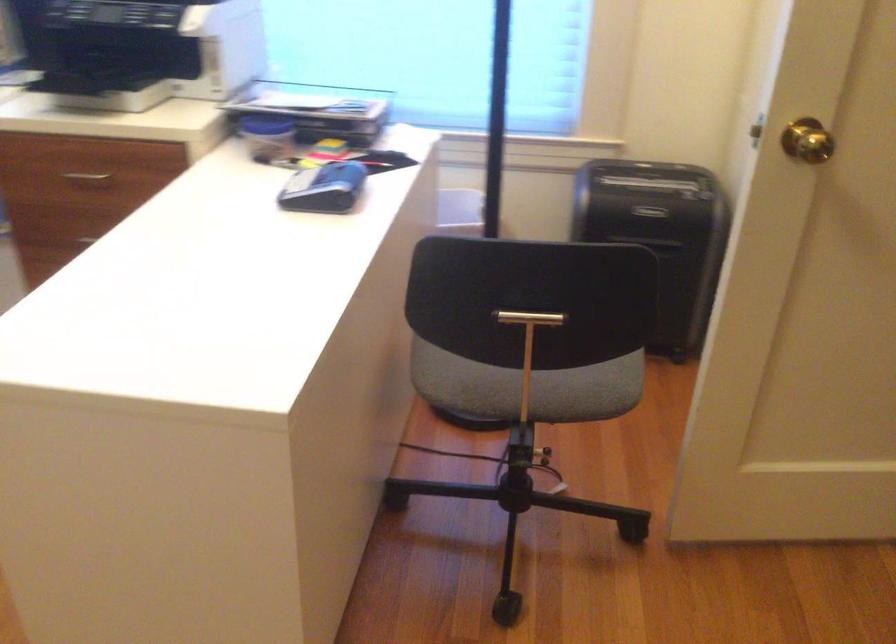
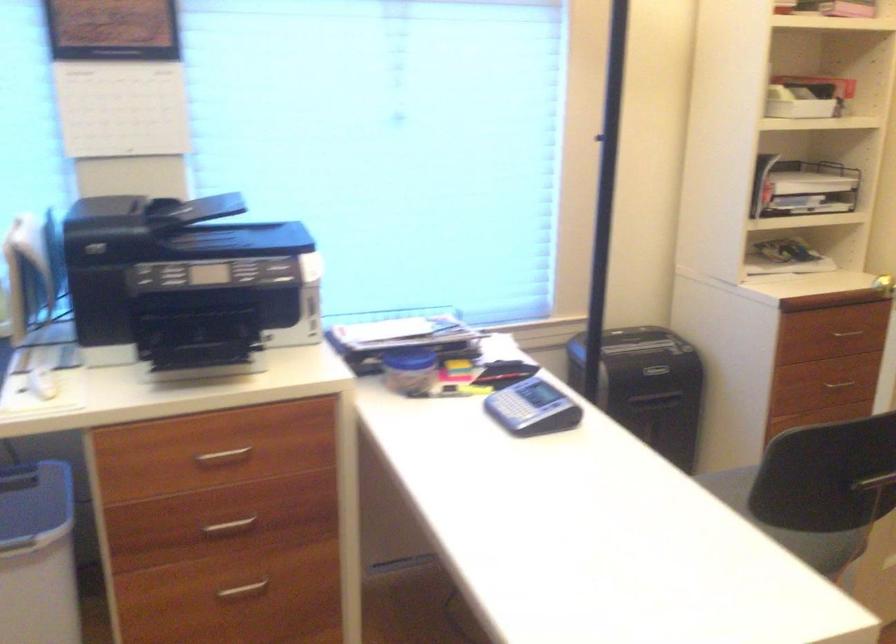
Where in the second image is the point corresponding to the point at 273,124 from the first image?

(409, 359)